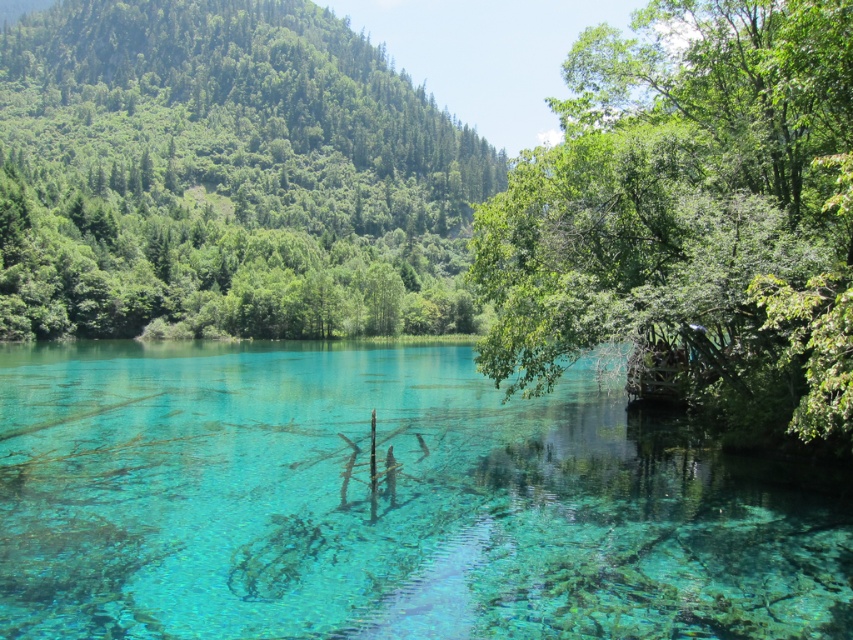
Does point (206, 612) lie in front of point (351, 304)?

Yes, point (206, 612) is closer to viewer.

Is transparent water at center behind green leafy tree at upper left?

That is False.

Locate an element on the screen. The image size is (853, 640). transparent water at center is located at coordinates (383, 502).

Does transparent water at center appear over green leafy tree at right?

No.

Based on the photo, is transparent water at center wider than green leafy tree at right?

Correct, the width of transparent water at center exceeds that of green leafy tree at right.

Is point (312, 404) in front of point (706, 72)?

No.

This screenshot has height=640, width=853. In order to click on transparent water at center in this screenshot , I will do `click(383, 502)`.

Looking at this image, is green leafy tree at upper left smaller than green leafy tree at right?

No, green leafy tree at upper left is not smaller than green leafy tree at right.

Is green leafy tree at upper left shorter than green leafy tree at right?

In fact, green leafy tree at upper left may be taller than green leafy tree at right.

Does point (192, 113) come farther from viewer compared to point (538, 332)?

That is True.

Find the location of a particular element. The height and width of the screenshot is (640, 853). green leafy tree at upper left is located at coordinates (225, 177).